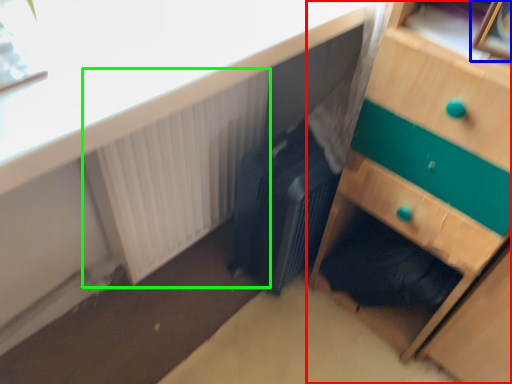
Question: Which object is the closest to the chest of drawers (highlighted by a red box)? Choose among these: picture frame (highlighted by a blue box) or radiator (highlighted by a green box).

Choices:
 (A) picture frame
 (B) radiator

Answer: (A)